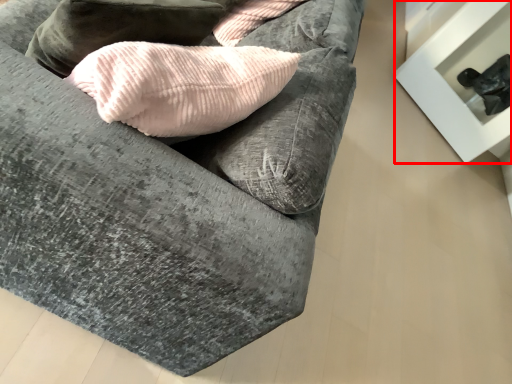
Question: Observing the image, what is the correct spatial positioning of furniture (annotated by the red box) in reference to studio couch?

Choices:
 (A) left
 (B) right

Answer: (B)